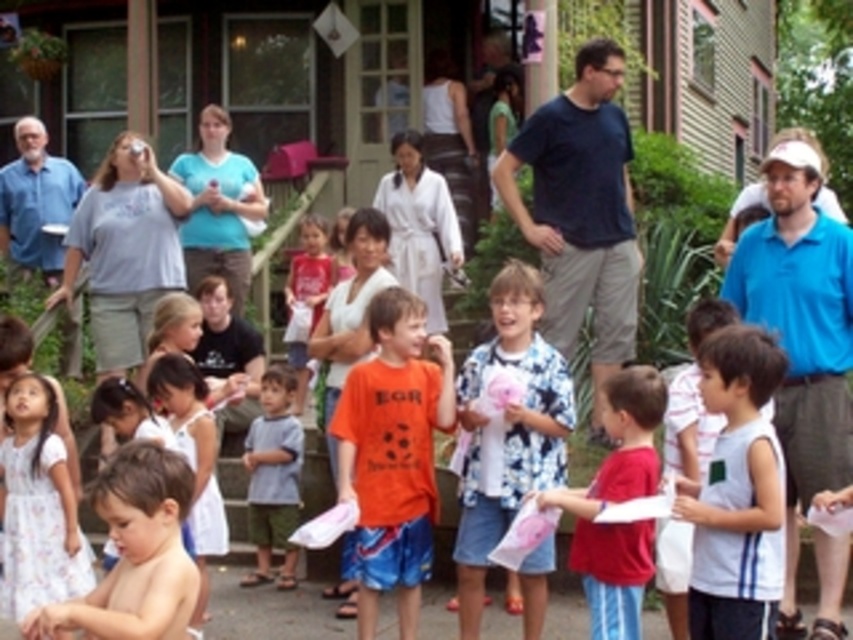
Question: Is dark blue t-shirt at center positioned in front of white sleeveless shirt at center?

Choices:
 (A) yes
 (B) no

Answer: (B)

Question: Which object is positioned closest to the floral shirt at center?

Choices:
 (A) orange cotton shirt at center
 (B) gray cotton shirt at center

Answer: (A)

Question: Is white sleeveless shirt at center bigger than gray cotton shirt at center?

Choices:
 (A) no
 (B) yes

Answer: (B)

Question: Which point is closer to the camera?

Choices:
 (A) (41, 424)
 (B) (579, 560)
 (C) (543, 104)

Answer: (B)

Question: Considering the relative positions of white sleeveless shirt at center and floral shirt at center in the image provided, where is white sleeveless shirt at center located with respect to floral shirt at center?

Choices:
 (A) above
 (B) below

Answer: (A)

Question: Estimate the real-world distances between objects in this image. Which object is closer to the orange cotton shirt at center?

Choices:
 (A) red cotton shirt at center
 (B) shiny orange shirt at lower left
 (C) white floral dress at lower left
 (D) dark blue t-shirt at center

Answer: (A)